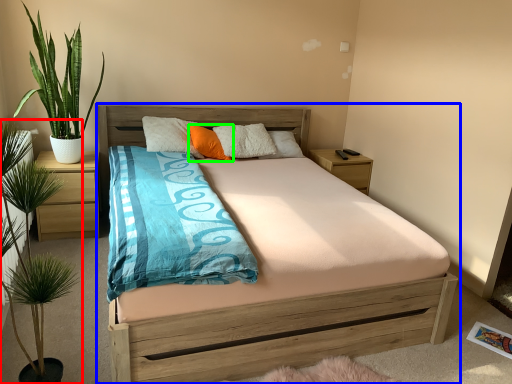
Question: Considering the real-world distances, which object is closest to houseplant (highlighted by a red box)? bed (highlighted by a blue box) or pillow (highlighted by a green box).

Choices:
 (A) bed
 (B) pillow

Answer: (A)